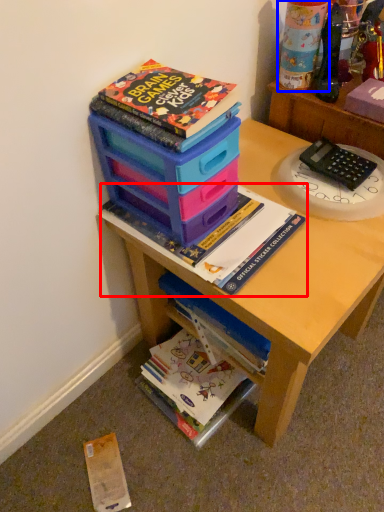
Question: Which object is further to the camera taking this photo, book (highlighted by a red box) or toy (highlighted by a blue box)?

Choices:
 (A) book
 (B) toy

Answer: (B)